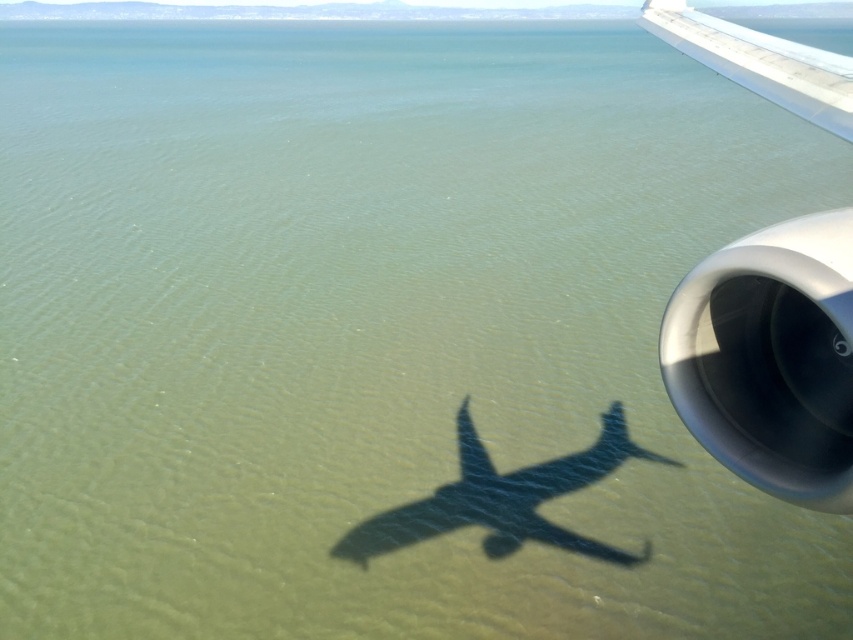
You are a passenger sitting near the window and notice the silver metallic engine at right and the white metallic wing at upper right. Which object appears narrower when viewed from your seat?

The silver metallic engine at right appears narrower than the white metallic wing at upper right because its width is lesser compared to the wing.

You are a passenger sitting in the airplane and looking out the window. You notice the silver metallic engine at right and the white metallic wing at upper right. Which object appears taller from your viewpoint?

The silver metallic engine at right has a lesser height compared to the white metallic wing at upper right, so the white metallic wing at upper right appears taller from your viewpoint.